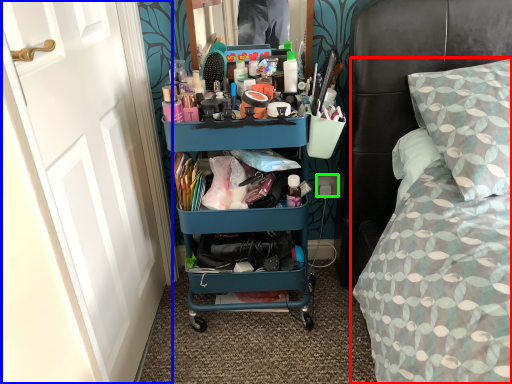
Question: Considering the real-world distances, which object is closest to bed (highlighted by a red box)? door (highlighted by a blue box) or power outlet (highlighted by a green box).

Choices:
 (A) door
 (B) power outlet

Answer: (B)